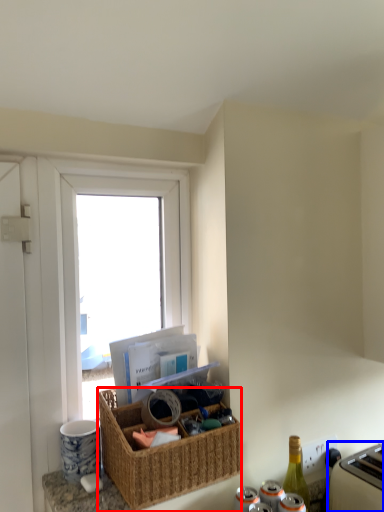
Question: Among these objects, which one is nearest to the camera, picnic basket (highlighted by a red box) or appliance (highlighted by a blue box)?

Choices:
 (A) picnic basket
 (B) appliance

Answer: (A)